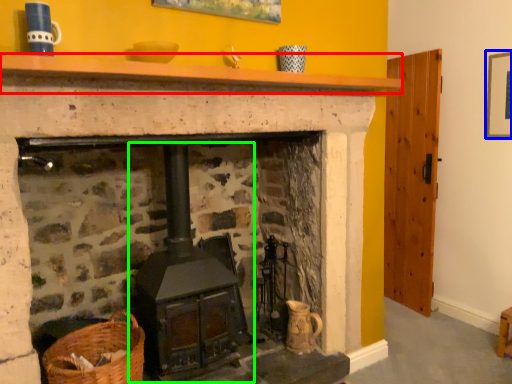
Question: Which object is positioned closest to mantle (highlighted by a red box)? Select from picture frame (highlighted by a blue box) and stove (highlighted by a green box).

Choices:
 (A) picture frame
 (B) stove

Answer: (B)